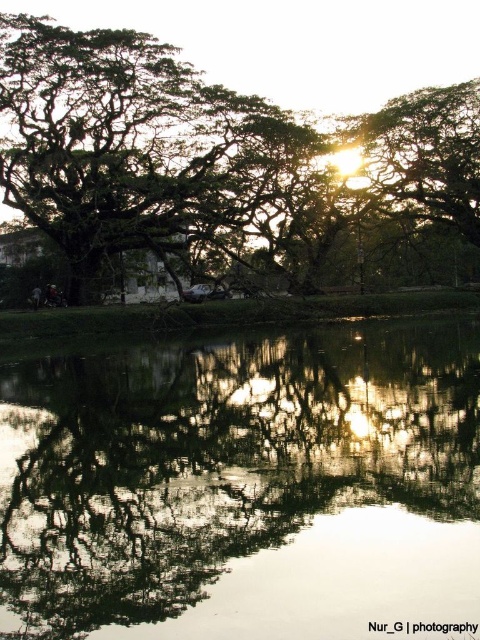
Does point (129, 461) come in front of point (466, 84)?

Yes, it is.

Does transparent water at center appear on the right side of green leafy tree at upper left?

Incorrect, transparent water at center is not on the right side of green leafy tree at upper left.

The width and height of the screenshot is (480, 640). I want to click on transparent water at center, so click(x=243, y=486).